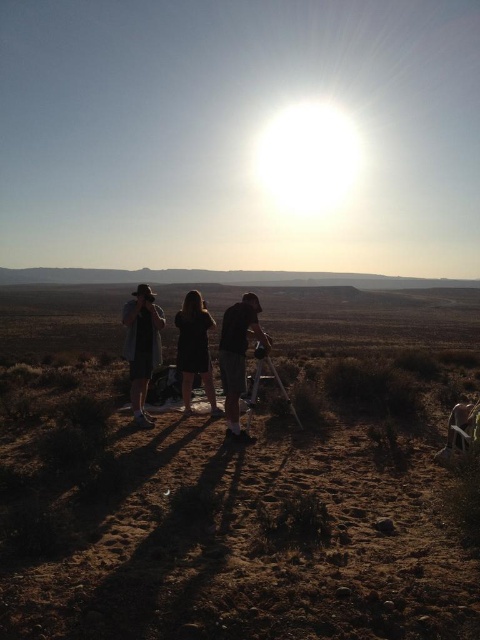
You are a photographer trying to capture a landscape shot with the brown dry grass at lower center and the black fabric dress at center in the frame. Which object appears wider in the photo?

The brown dry grass at lower center appears wider than the black fabric dress at center in the photo because its width surpasses that of the dress.

Based on the photo, you are a photographer setting up a tripod in a desert landscape. You have a matte black tripod at center and notice brown dry grass at lower center nearby. Which object takes up more horizontal space in the scene?

The brown dry grass at lower center takes up more horizontal space than the matte black tripod at center because its width is larger.